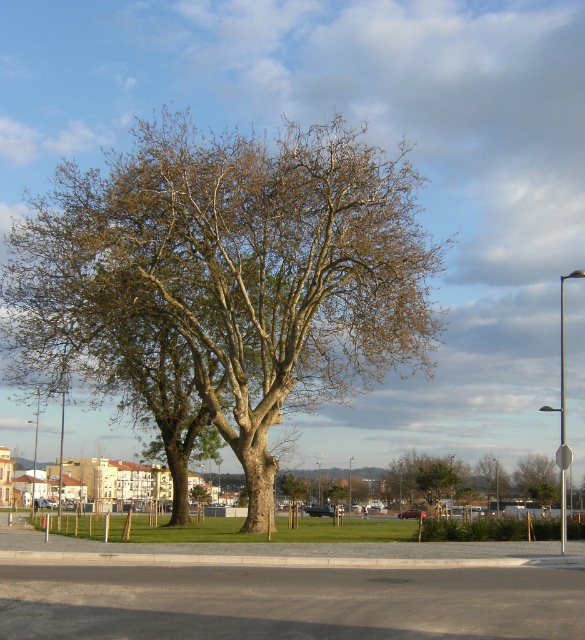
How far apart are green rough bark tree at center and green leafy tree at lower right?

The distance of green rough bark tree at center from green leafy tree at lower right is 30.82 meters.

Consider the image. Is green rough bark tree at center to the right of green leafy tree at lower right from the viewer's perspective?

No, green rough bark tree at center is not to the right of green leafy tree at lower right.

Image resolution: width=585 pixels, height=640 pixels. What do you see at coordinates (239, 269) in the screenshot? I see `green rough bark tree at center` at bounding box center [239, 269].

You are a GUI agent. You are given a task and a screenshot of the screen. Output one action in this format:
    pyautogui.click(x=<x>, y=<y>)
    Task: Click on the green rough bark tree at center
    The width and height of the screenshot is (585, 640).
    Given the screenshot: What is the action you would take?
    pyautogui.click(x=239, y=269)